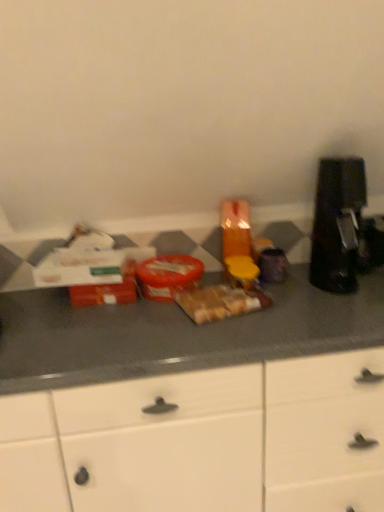
I want to click on free space in front of black plastic coffee machine at right, so click(x=331, y=303).